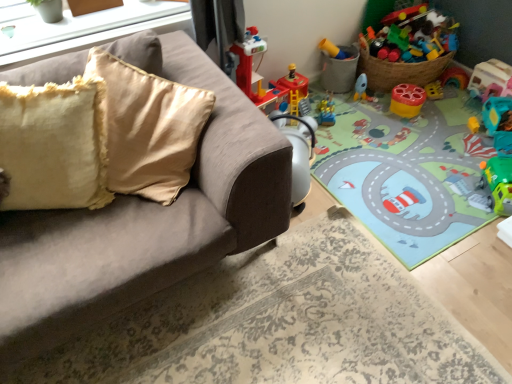
Image resolution: width=512 pixels, height=384 pixels. I want to click on vacant area that lies between rubber duck at lower right, marked as the fifth toy in a left-to-right arrangement, and yellow plastic cup at center-right, acting as the 4th toy starting from the right, so click(x=445, y=118).